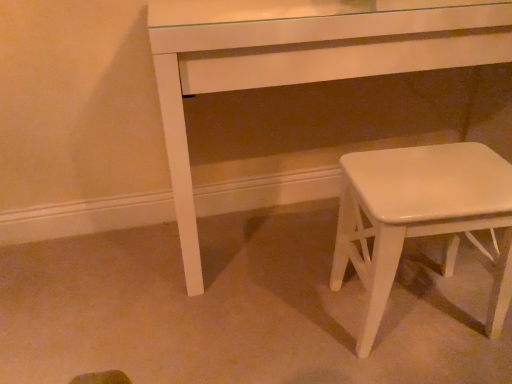
Image resolution: width=512 pixels, height=384 pixels. Describe the element at coordinates (420, 217) in the screenshot. I see `white glossy stool at lower right` at that location.

Locate an element on the screen. This screenshot has width=512, height=384. white glossy stool at lower right is located at coordinates (420, 217).

What do you see at coordinates (301, 58) in the screenshot? I see `white glossy table at center` at bounding box center [301, 58].

The image size is (512, 384). Find the location of `white glossy table at center`. white glossy table at center is located at coordinates (301, 58).

Identify the location of white glossy stool at lower right. (420, 217).

In the image, is white glossy table at center on the left side or the right side of white glossy stool at lower right?

Clearly, white glossy table at center is on the left of white glossy stool at lower right in the image.

Does white glossy table at center lie behind white glossy stool at lower right?

Yes, white glossy table at center is further from the camera.

Which is behind, point (170, 166) or point (507, 212)?

Positioned behind is point (170, 166).

In the scene shown: From the image's perspective, is white glossy table at center above or below white glossy stool at lower right?

Based on their image positions, white glossy table at center is located above white glossy stool at lower right.

From a real-world perspective, is white glossy table at center over white glossy stool at lower right?

Correct, in the physical world, white glossy table at center is higher than white glossy stool at lower right.

Looking at their sizes, would you say white glossy table at center is wider or thinner than white glossy stool at lower right?

Considering their sizes, white glossy table at center looks broader than white glossy stool at lower right.

Considering the sizes of objects white glossy table at center and white glossy stool at lower right in the image provided, who is taller, white glossy table at center or white glossy stool at lower right?

With more height is white glossy table at center.

Can you confirm if white glossy table at center is bigger than white glossy stool at lower right?

Yes, white glossy table at center is bigger than white glossy stool at lower right.

Is white glossy stool at lower right completely or partially inside white glossy table at center?

No, white glossy stool at lower right is not inside white glossy table at center.

Is white glossy table at center in contact with white glossy stool at lower right?

No.

In the scene shown: Is white glossy table at center facing towards white glossy stool at lower right?

Yes, white glossy table at center faces towards white glossy stool at lower right.

Identify the location of stool below the white glossy table at center (from the image's perspective). (420, 217).

Which object is positioned more to the right, white glossy stool at lower right or white glossy table at center?

white glossy stool at lower right.

From the picture: Which object is closer to the camera, white glossy stool at lower right or white glossy table at center?

white glossy stool at lower right is in front.

Is point (413, 175) closer or farther from the camera than point (453, 65)?

Point (413, 175) is closer to the camera than point (453, 65).

In the scene shown: From the image's perspective, is white glossy stool at lower right located above white glossy table at center?

No, from the image's perspective, white glossy stool at lower right is not above white glossy table at center.

Looking at this image, from a real-world perspective, is white glossy stool at lower right positioned under white glossy table at center based on gravity?

Correct, in the physical world, white glossy stool at lower right is lower than white glossy table at center.

Can you confirm if white glossy stool at lower right is thinner than white glossy table at center?

Indeed, white glossy stool at lower right has a lesser width compared to white glossy table at center.

Can you confirm if white glossy stool at lower right is shorter than white glossy table at center?

Yes.

Considering the sizes of white glossy stool at lower right and white glossy table at center in the image, is white glossy stool at lower right bigger or smaller than white glossy table at center?

Considering their sizes, white glossy stool at lower right takes up less space than white glossy table at center.

Does white glossy stool at lower right contain white glossy table at center?

No, white glossy stool at lower right does not contain white glossy table at center.

Is white glossy stool at lower right touching white glossy table at center?

white glossy stool at lower right is not next to white glossy table at center, and they're not touching.

Does white glossy stool at lower right turn towards white glossy table at center?

No.

What's the angular difference between white glossy stool at lower right and white glossy table at center's facing directions?

The facing directions of white glossy stool at lower right and white glossy table at center are 0.178 degrees apart.

At what (x,y) coordinates should I click in order to perform the action: click on stool that is on the right side of white glossy table at center. Please return your answer as a coordinate pair (x, y). This screenshot has width=512, height=384. Looking at the image, I should click on (420, 217).

This screenshot has height=384, width=512. I want to click on table on the left side of white glossy stool at lower right, so click(x=301, y=58).

Locate an element on the screen. The height and width of the screenshot is (384, 512). table above the white glossy stool at lower right (from the image's perspective) is located at coordinates (301, 58).